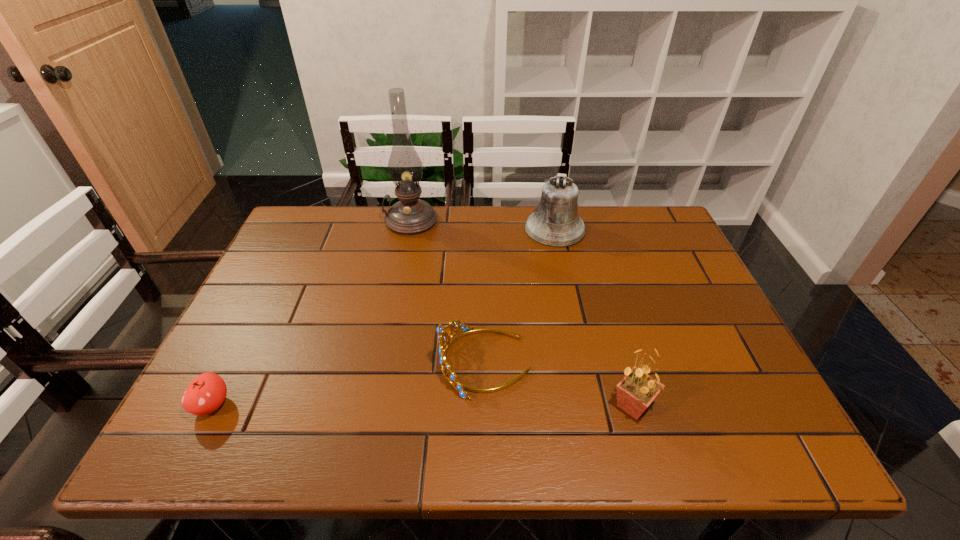
Identify the location of free space between the shortest object and the bell. (383, 317).

You are a GUI agent. You are given a task and a screenshot of the screen. Output one action in this format:
    pyautogui.click(x=<x>, y=<y>)
    Task: Click on the vacant space that's between the tiara and the bell
    The width and height of the screenshot is (960, 540).
    Given the screenshot: What is the action you would take?
    pyautogui.click(x=520, y=295)

Locate an element on the screen. Image resolution: width=960 pixels, height=540 pixels. free area in between the sunflower and the bell is located at coordinates (594, 317).

Find the location of a particular element. This screenshot has width=960, height=540. free space between the sunflower and the apple is located at coordinates (422, 406).

The height and width of the screenshot is (540, 960). I want to click on vacant area that lies between the tallest object and the shortest object, so click(312, 313).

The height and width of the screenshot is (540, 960). I want to click on free point between the third object from left to right and the shortest object, so click(348, 384).

Locate an element on the screen. The height and width of the screenshot is (540, 960). vacant space that's between the apple and the bell is located at coordinates (383, 317).

Find the location of a particular element. This screenshot has width=960, height=540. free point between the bell and the fourth tallest object is located at coordinates (520, 295).

At what (x,y) coordinates should I click in order to perform the action: click on vacant space in between the bell and the leftmost object. Please return your answer as a coordinate pair (x, y). This screenshot has width=960, height=540. Looking at the image, I should click on (383, 317).

Find the location of `free space between the apple and the tiara`. free space between the apple and the tiara is located at coordinates (348, 384).